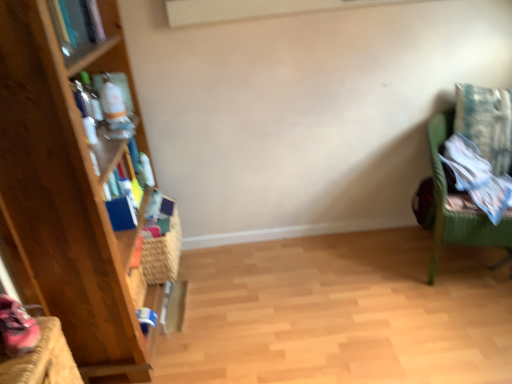
Where is `free space that is to the left of green wicker chair at right`? The image size is (512, 384). free space that is to the left of green wicker chair at right is located at coordinates (381, 268).